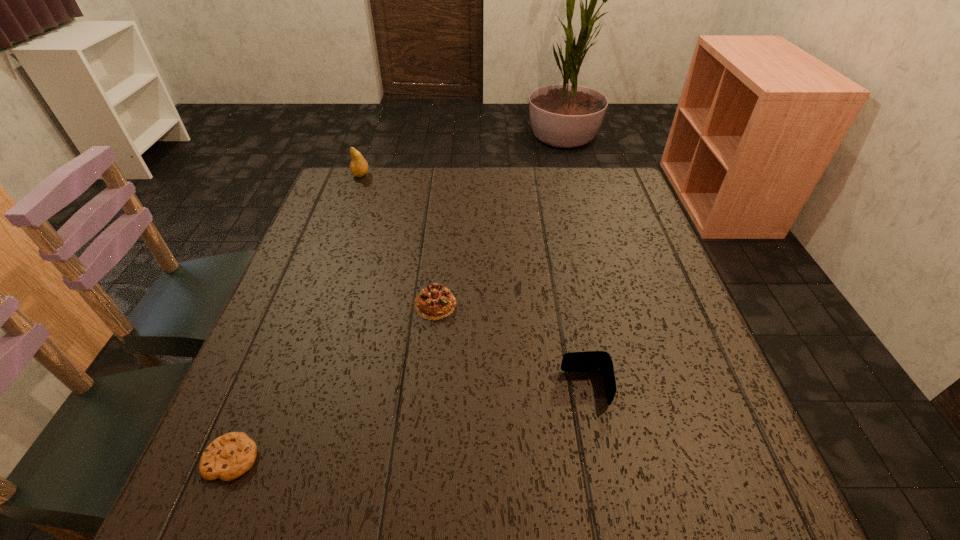
Where is `free space located 0.290m on the outer surface of the second nearest object`? This screenshot has width=960, height=540. free space located 0.290m on the outer surface of the second nearest object is located at coordinates (405, 388).

Image resolution: width=960 pixels, height=540 pixels. Find the location of `free space located on the outer surface of the second nearest object`. free space located on the outer surface of the second nearest object is located at coordinates (497, 388).

Locate an element on the screen. The width and height of the screenshot is (960, 540). vacant space situated on the front of the third tallest object is located at coordinates (415, 508).

The image size is (960, 540). I want to click on vacant space located on the back of the cookie, so click(x=270, y=366).

The height and width of the screenshot is (540, 960). Find the location of `object that is at the far edge`. object that is at the far edge is located at coordinates pyautogui.click(x=359, y=167).

You are a GUI agent. You are given a task and a screenshot of the screen. Output one action in this format:
    pyautogui.click(x=<x>, y=<y>)
    Task: Click on the object that is at the near edge
    
    Given the screenshot: What is the action you would take?
    229,456

The image size is (960, 540). I want to click on pear situated at the left edge, so click(359, 167).

You are a GUI agent. You are given a task and a screenshot of the screen. Output one action in this format:
    pyautogui.click(x=<x>, y=<y>)
    Task: Click on the cookie that is at the left edge
    This screenshot has height=540, width=960.
    Given the screenshot: What is the action you would take?
    pyautogui.click(x=229, y=456)

You are a GUI agent. You are given a task and a screenshot of the screen. Output one action in this format:
    pyautogui.click(x=<x>, y=<y>)
    Task: Click on the object present at the far left corner
    
    Given the screenshot: What is the action you would take?
    pyautogui.click(x=359, y=167)

What are the coordinates of `object that is at the near left corner` in the screenshot? It's located at (229, 456).